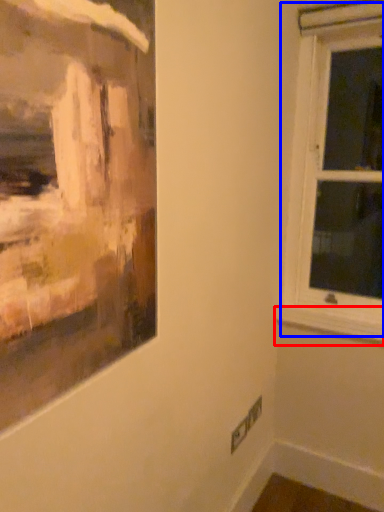
Question: Which point is further to the camera, window sill (highlighted by a red box) or window (highlighted by a blue box)?

Choices:
 (A) window sill
 (B) window

Answer: (A)